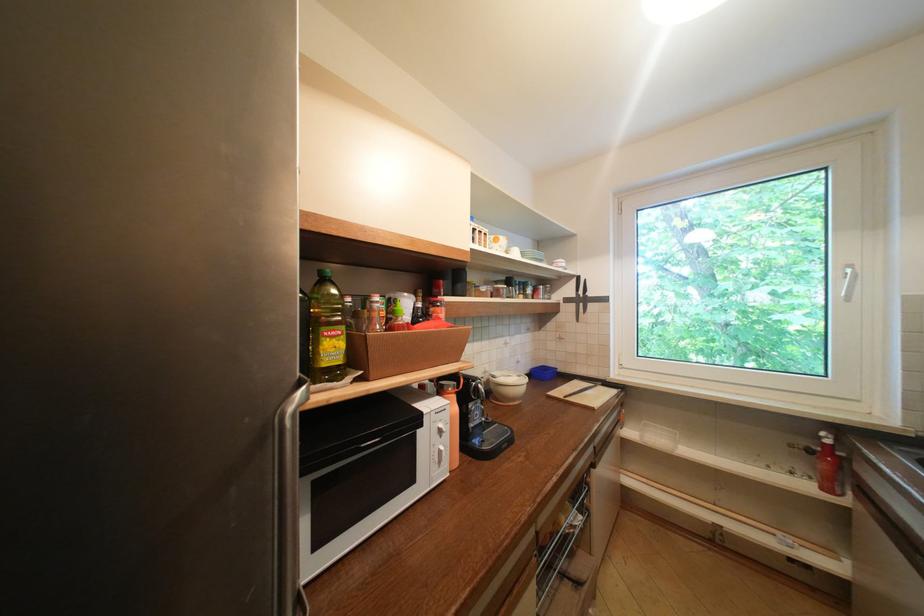
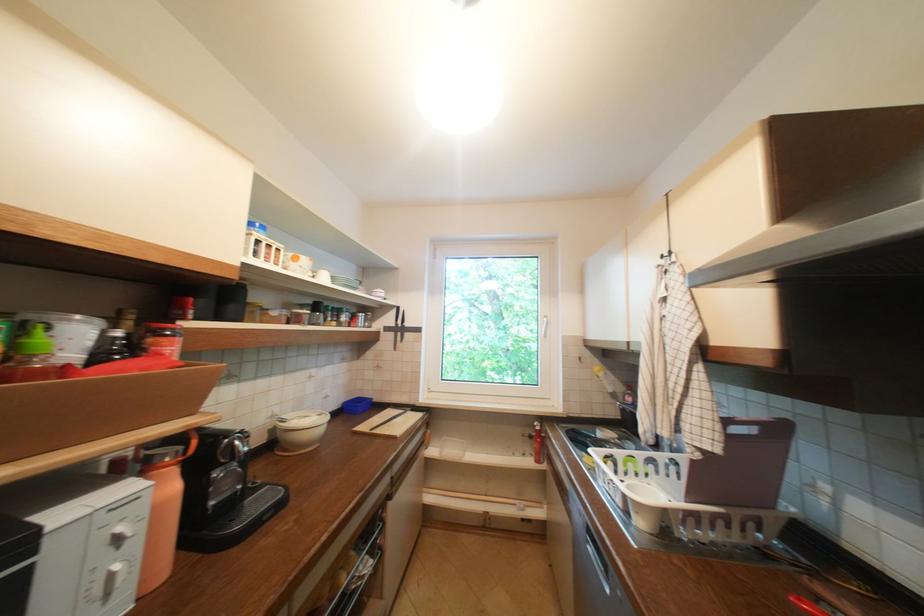
Question: The camera is either moving clockwise (left) or counter-clockwise (right) around the object. The first image is from the beginning of the video and the second image is from the end. Is the camera moving left or right when shooting the video?

Choices:
 (A) Left
 (B) Right

Answer: (A)